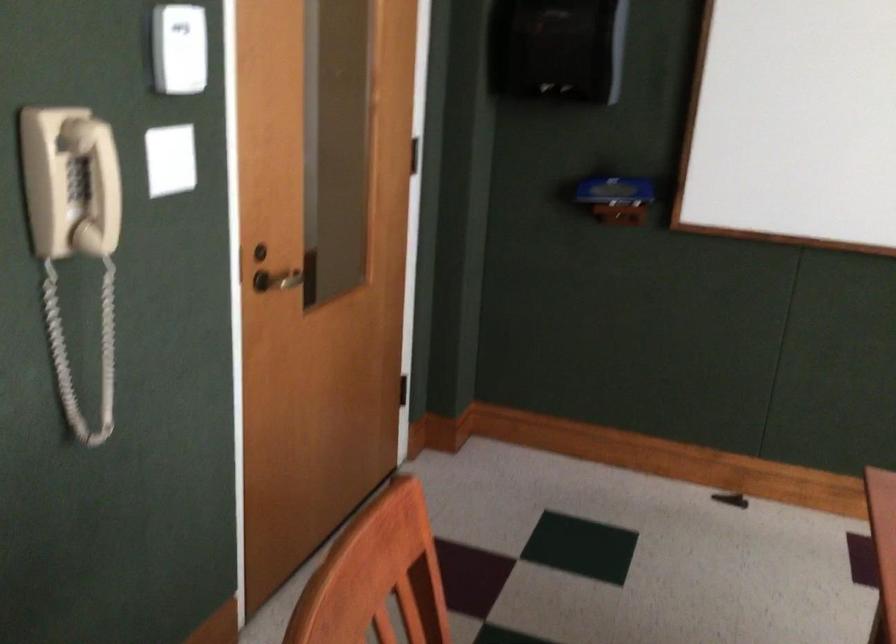
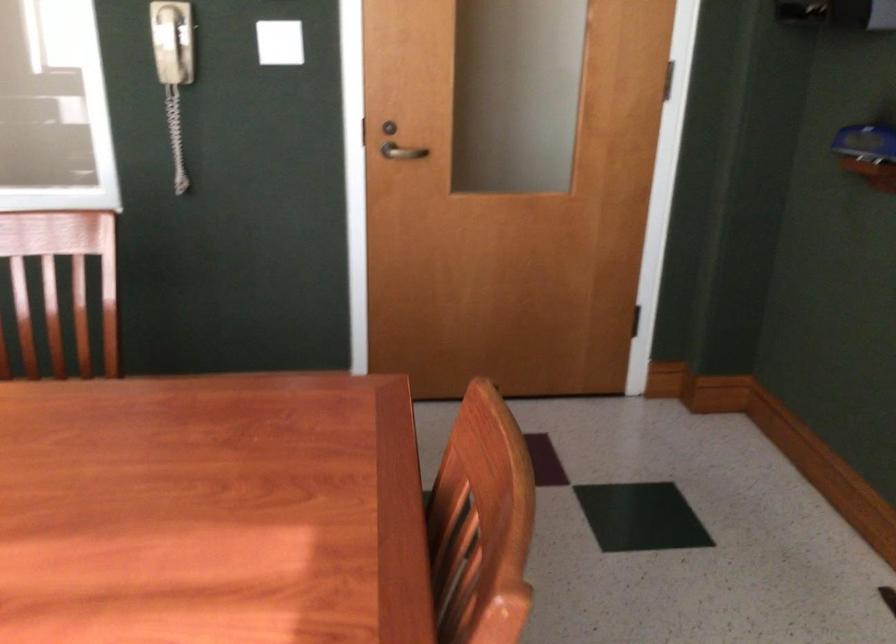
The point at (x=115, y=184) is marked in the first image. Where is the corresponding point in the second image?

(171, 41)